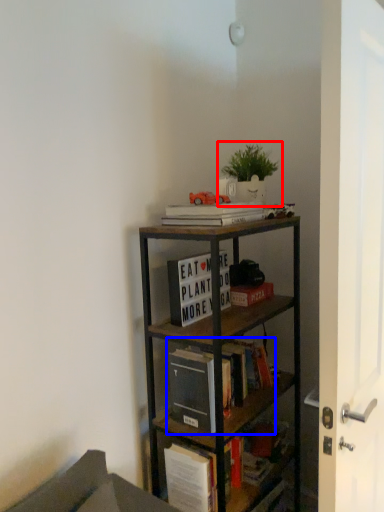
Question: Which object appears closest to the camera in this image, houseplant (highlighted by a red box) or book (highlighted by a blue box)?

Choices:
 (A) houseplant
 (B) book

Answer: (B)